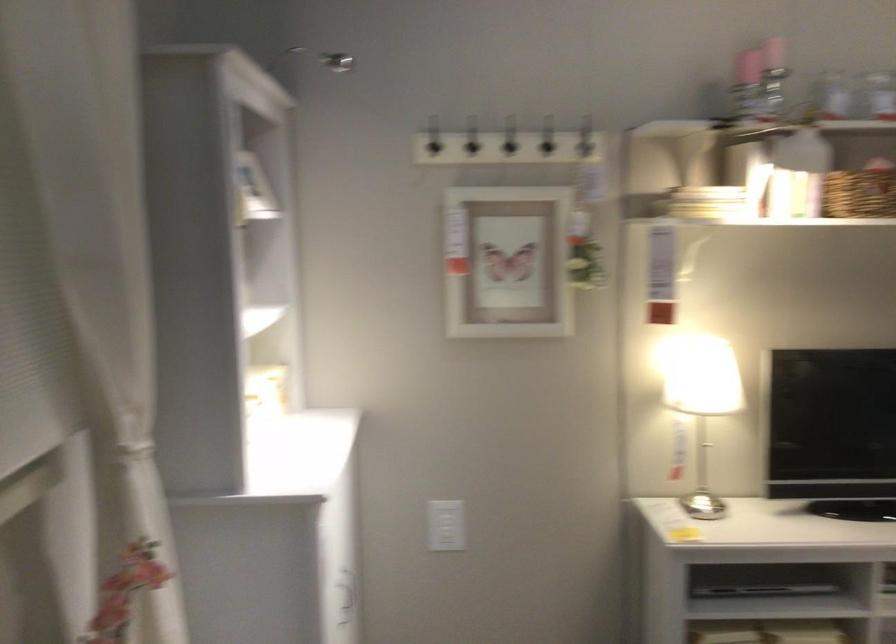
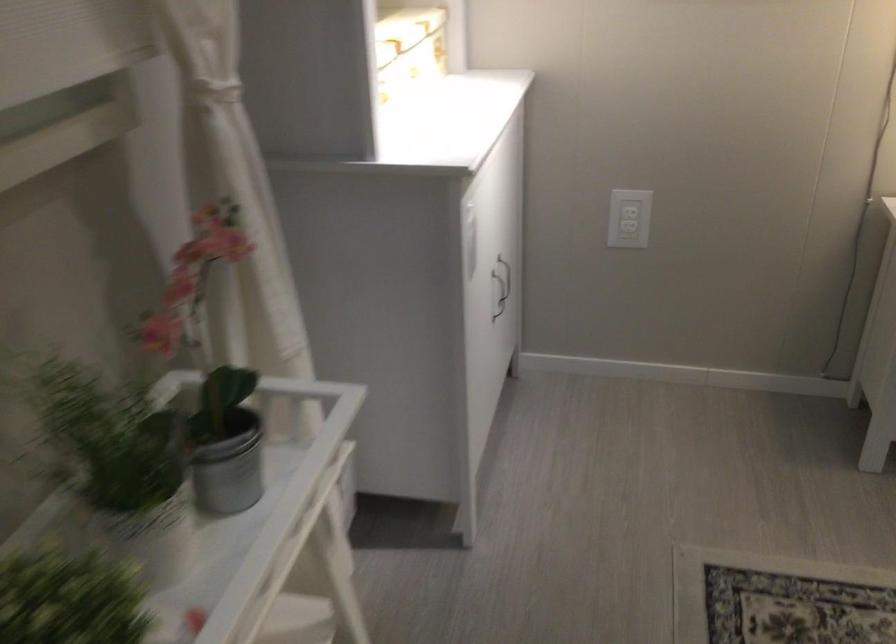
Locate, in the second image, the point that corresponds to [271,401] in the first image.

(410, 44)